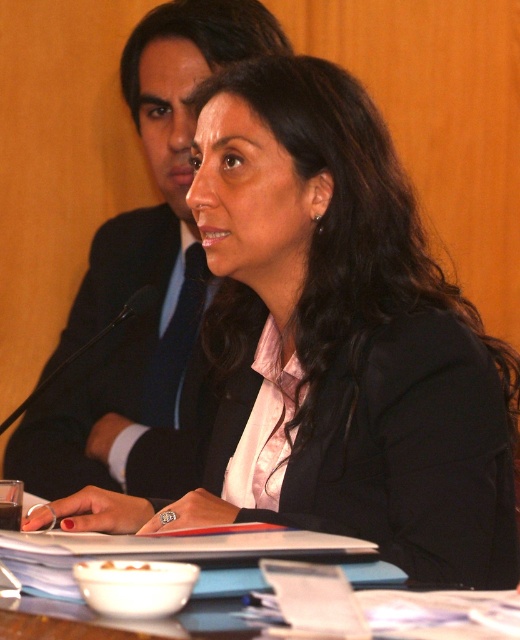
You are attending a formal meeting and need to pass a document to the person wearing the black matte suit at upper center. The wooden table at center is between you and them. Can you walk around the table to reach them?

The black matte suit at upper center is to the left of the wooden table at center, so you can walk around the left side of the wooden table at center to reach them.

You are standing in front of the table where the two people are sitting. You want to place a small gift on the table closer to the person who is less obscured. Which point should you choose between point (x=166, y=224) and point (x=416, y=636)?

Point (x=166, y=224) is further to the viewer than point (x=416, y=636). The person less obscured is likely closer to the viewer, so place the gift at point (x=166, y=224).

You are organizing a small event and need to decide whether to place a large decorative centerpiece on the wooden table at center. Considering the black matte suit at upper center is also present, will there be enough space for the centerpiece?

The black matte suit at upper center has a larger size compared to wooden table at center, so placing a large decorative centerpiece might not be feasible due to limited space.